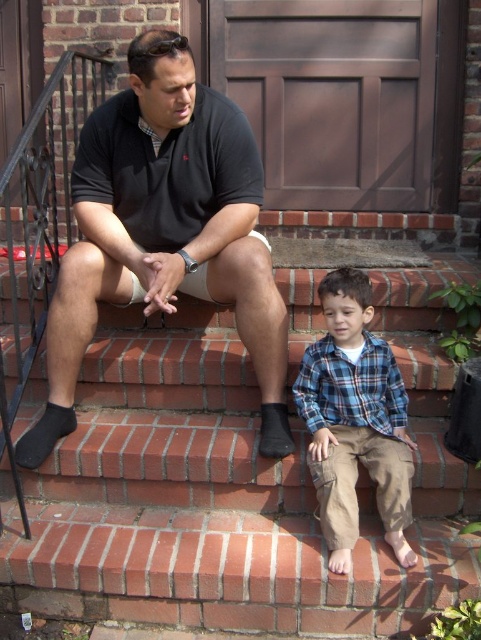
Question: Can you confirm if brick at center is wider than black matte shirt at upper left?

Choices:
 (A) no
 (B) yes

Answer: (B)

Question: Does brick at center appear over black matte shirt at upper left?

Choices:
 (A) yes
 (B) no

Answer: (B)

Question: Which of the following is the closest to the observer?

Choices:
 (A) blue plaid shirt at lower center
 (B) brick at center
 (C) black matte shirt at upper left

Answer: (B)

Question: Is brick at center bigger than blue plaid shirt at lower center?

Choices:
 (A) yes
 (B) no

Answer: (A)

Question: Which point appears closest to the camera in this image?

Choices:
 (A) (146, 243)
 (B) (365, 273)

Answer: (B)

Question: Which of the following is the farthest from the observer?

Choices:
 (A) black matte shirt at upper left
 (B) blue plaid shirt at lower center
 (C) brick at center

Answer: (A)